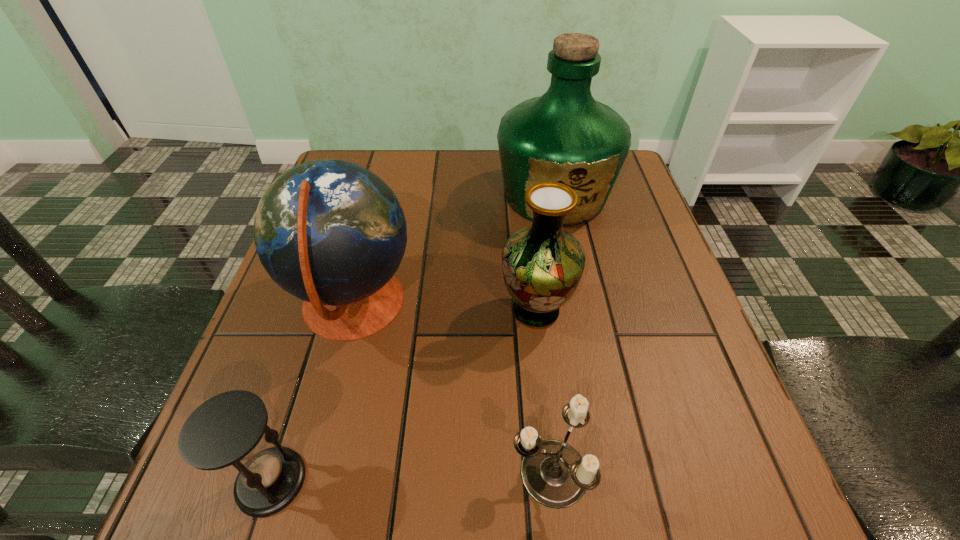
The height and width of the screenshot is (540, 960). What are the coordinates of `free space located on the left of the candle holder` in the screenshot? It's located at (403, 472).

Image resolution: width=960 pixels, height=540 pixels. I want to click on object present at the far edge, so pos(566,136).

Find the location of a particular element. The width and height of the screenshot is (960, 540). hourglass that is at the near edge is located at coordinates (225, 430).

Where is `candle holder that is at the near edge`? Image resolution: width=960 pixels, height=540 pixels. candle holder that is at the near edge is located at coordinates (554, 474).

Find the location of `globe located at the left edge`. globe located at the left edge is located at coordinates click(x=332, y=233).

Locate an element on the screen. The height and width of the screenshot is (540, 960). hourglass at the left edge is located at coordinates (225, 430).

You are a GUI agent. You are given a task and a screenshot of the screen. Output one action in this format:
    pyautogui.click(x=<x>, y=<y>)
    Task: Click on the object that is at the right edge
    The image size is (960, 540).
    Given the screenshot: What is the action you would take?
    pyautogui.click(x=566, y=136)

I want to click on object at the near left corner, so click(225, 430).

Locate an element on the screen. The height and width of the screenshot is (540, 960). object located in the far right corner section of the desktop is located at coordinates (566, 136).

Image resolution: width=960 pixels, height=540 pixels. Identify the location of free space at the far edge. (481, 178).